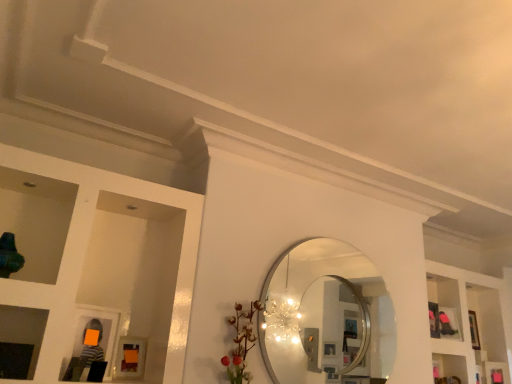
Question: From a real-world perspective, is white glossy shelves at upper right located beneath silver metallic mirror at center?

Choices:
 (A) yes
 (B) no

Answer: (B)

Question: From the image's perspective, is white glossy shelves at upper right located beneath silver metallic mirror at center?

Choices:
 (A) yes
 (B) no

Answer: (A)

Question: Is white glossy shelves at upper right next to silver metallic mirror at center?

Choices:
 (A) yes
 (B) no

Answer: (B)

Question: Is white glossy shelves at upper right outside of silver metallic mirror at center?

Choices:
 (A) no
 (B) yes

Answer: (B)

Question: Is the position of white glossy shelves at upper right more distant than that of silver metallic mirror at center?

Choices:
 (A) yes
 (B) no

Answer: (A)

Question: From a real-world perspective, is silver metallic mirror at center above or below white glossy shelves at upper right?

Choices:
 (A) above
 (B) below

Answer: (B)

Question: In the image, is silver metallic mirror at center positioned in front of or behind white glossy shelves at upper right?

Choices:
 (A) behind
 (B) front

Answer: (B)

Question: Is point (291, 367) positioned closer to the camera than point (478, 279)?

Choices:
 (A) closer
 (B) farther

Answer: (A)

Question: From the image's perspective, is silver metallic mirror at center positioned above or below white glossy shelves at upper right?

Choices:
 (A) above
 (B) below

Answer: (A)

Question: Relative to matte orange picture frame at lower left, is silver metallic mirror at center in front or behind?

Choices:
 (A) front
 (B) behind

Answer: (B)

Question: Is silver metallic mirror at center inside the boundaries of matte orange picture frame at lower left, or outside?

Choices:
 (A) inside
 (B) outside

Answer: (B)

Question: Considering the positions of silver metallic mirror at center and matte orange picture frame at lower left in the image, is silver metallic mirror at center taller or shorter than matte orange picture frame at lower left?

Choices:
 (A) tall
 (B) short

Answer: (A)

Question: Is point (325, 243) closer or farther from the camera than point (144, 340)?

Choices:
 (A) closer
 (B) farther

Answer: (B)

Question: Do you think white glossy shelves at upper right is within silver metallic mirror at center, or outside of it?

Choices:
 (A) outside
 (B) inside

Answer: (A)

Question: In terms of size, does white glossy shelves at upper right appear bigger or smaller than silver metallic mirror at center?

Choices:
 (A) small
 (B) big

Answer: (B)